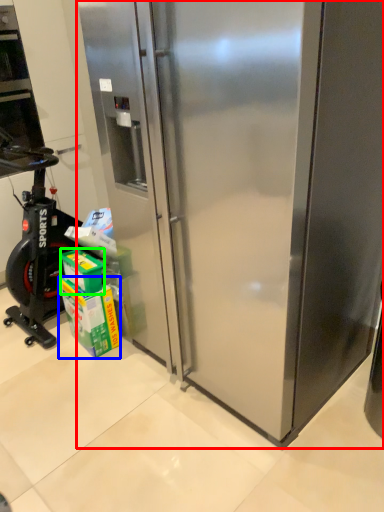
Question: Which object is positioned farthest from refrigerator (highlighted by a red box)? Select from carton (highlighted by a blue box) and box (highlighted by a green box).

Choices:
 (A) carton
 (B) box

Answer: (B)